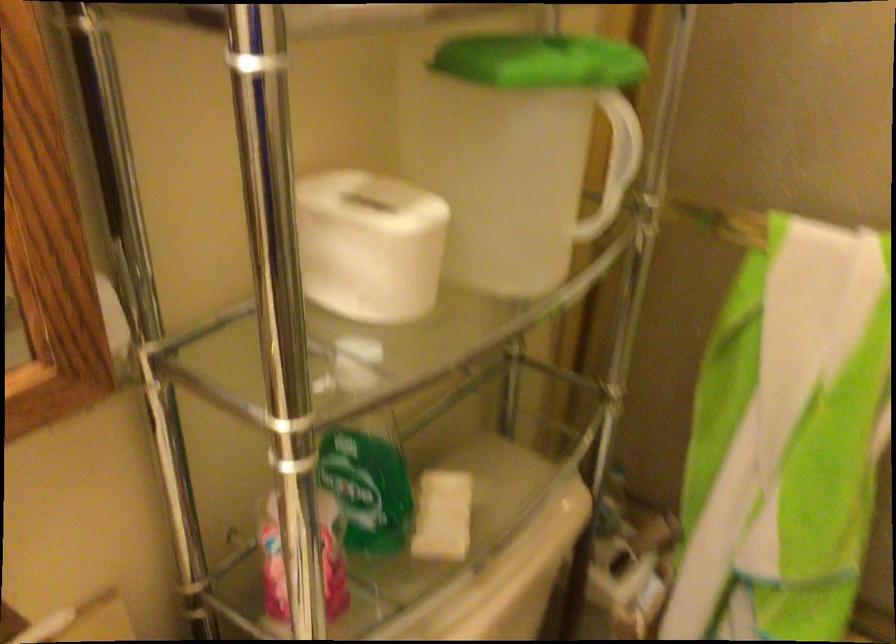
What do you see at coordinates (618, 152) in the screenshot? The width and height of the screenshot is (896, 644). I see `the white pitcher handle` at bounding box center [618, 152].